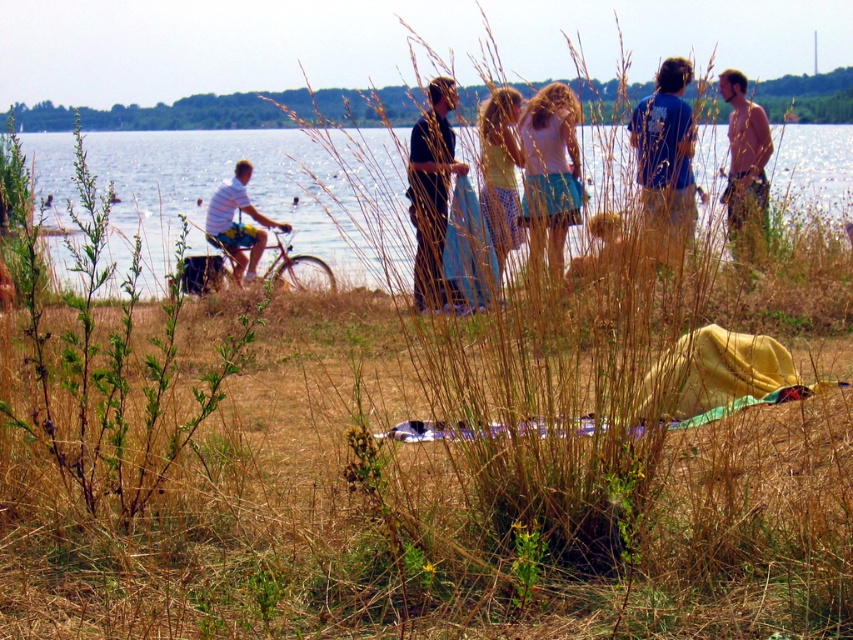
Question: Does clear blue water at center come behind yellow cotton shirt at center?

Choices:
 (A) yes
 (B) no

Answer: (B)

Question: Is clear blue water at center below yellow cotton shirt at center?

Choices:
 (A) yes
 (B) no

Answer: (B)

Question: Among these points, which one is farthest from the camera?

Choices:
 (A) (502, 147)
 (B) (62, 416)

Answer: (A)

Question: Is the position of clear blue water at center less distant than that of blonde hair at center?

Choices:
 (A) no
 (B) yes

Answer: (B)

Question: Estimate the real-world distances between objects in this image. Which object is farther from the shiny brown hair at right?

Choices:
 (A) yellow cotton shirt at center
 (B) green leafy plant at left
 (C) clear blue water at center

Answer: (B)

Question: Which point appears farthest from the camera in this image?

Choices:
 (A) (660, 125)
 (B) (589, 276)
 (C) (735, 184)

Answer: (C)